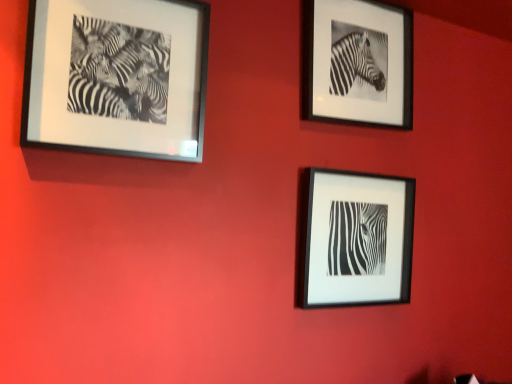
Question: Is black matte frame at center, the 2th picture frame in the left-to-right sequence, taller or shorter than black matte frame at upper right, which appears as the 3th picture frame when viewed from the left?

Choices:
 (A) short
 (B) tall

Answer: (A)

Question: Considering the positions of point (336, 193) and point (385, 107), is point (336, 193) closer or farther from the camera than point (385, 107)?

Choices:
 (A) farther
 (B) closer

Answer: (B)

Question: Considering the real-world distances, which object is closest to the black matte frame at center, the 2th picture frame in the left-to-right sequence?

Choices:
 (A) black matte frame at upper right, which appears as the 3th picture frame when viewed from the left
 (B) black matte photo frame at upper left, the 3th picture frame positioned from the right

Answer: (A)

Question: Based on their relative distances, which object is farther from the black matte frame at center, the 2th picture frame in the left-to-right sequence?

Choices:
 (A) black matte photo frame at upper left, which is the first picture frame from left to right
 (B) black matte frame at upper right, which appears as the 3th picture frame when viewed from the left

Answer: (A)